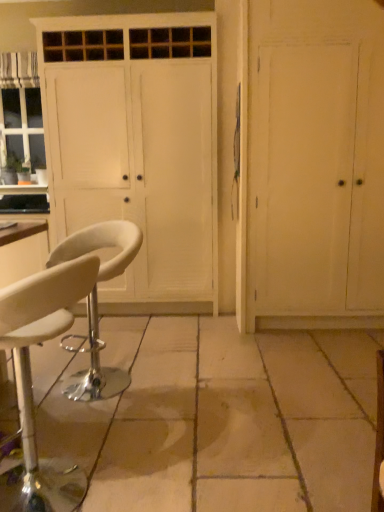
Question: Does white leather stool at lower left, the second chair from the back, have a greater height compared to white leather stool at lower left, the second chair from the front?

Choices:
 (A) yes
 (B) no

Answer: (A)

Question: Is white leather stool at lower left, the second chair from the back, far away from white leather stool at lower left, the first chair when ordered from back to front?

Choices:
 (A) no
 (B) yes

Answer: (A)

Question: From a real-world perspective, is white leather stool at lower left, the second chair from the back, physically below white leather stool at lower left, the first chair when ordered from back to front?

Choices:
 (A) no
 (B) yes

Answer: (A)

Question: Can you confirm if white leather stool at lower left, placed as the 1th chair when sorted from front to back, is positioned to the right of white leather stool at lower left, the first chair when ordered from back to front?

Choices:
 (A) no
 (B) yes

Answer: (A)

Question: Is white leather stool at lower left, placed as the 1th chair when sorted from front to back, smaller than white leather stool at lower left, the first chair when ordered from back to front?

Choices:
 (A) no
 (B) yes

Answer: (B)

Question: Could you tell me if white leather stool at lower left, the second chair from the back, is turned towards white leather stool at lower left, the second chair from the front?

Choices:
 (A) yes
 (B) no

Answer: (B)

Question: Is the position of white wood cabinet at center more distant than that of white leather stool at lower left, the second chair from the back?

Choices:
 (A) no
 (B) yes

Answer: (B)

Question: Is white wood cabinet at center at the left side of white leather stool at lower left, placed as the 1th chair when sorted from front to back?

Choices:
 (A) no
 (B) yes

Answer: (A)

Question: Considering the relative sizes of white wood cabinet at center and white leather stool at lower left, placed as the 1th chair when sorted from front to back, in the image provided, is white wood cabinet at center thinner than white leather stool at lower left, placed as the 1th chair when sorted from front to back,?

Choices:
 (A) no
 (B) yes

Answer: (A)

Question: Considering the relative positions of white wood cabinet at center and white leather stool at lower left, placed as the 1th chair when sorted from front to back, in the image provided, is white wood cabinet at center in front of white leather stool at lower left, placed as the 1th chair when sorted from front to back,?

Choices:
 (A) no
 (B) yes

Answer: (A)

Question: Would you say white leather stool at lower left, placed as the 1th chair when sorted from front to back, is part of white wood cabinet at center's contents?

Choices:
 (A) yes
 (B) no

Answer: (B)

Question: Can you confirm if white wood cabinet at center is shorter than white leather stool at lower left, the second chair from the back?

Choices:
 (A) yes
 (B) no

Answer: (B)

Question: Considering the relative sizes of white wood cabinet at center and white leather stool at lower left, the first chair when ordered from back to front, in the image provided, is white wood cabinet at center smaller than white leather stool at lower left, the first chair when ordered from back to front,?

Choices:
 (A) yes
 (B) no

Answer: (B)